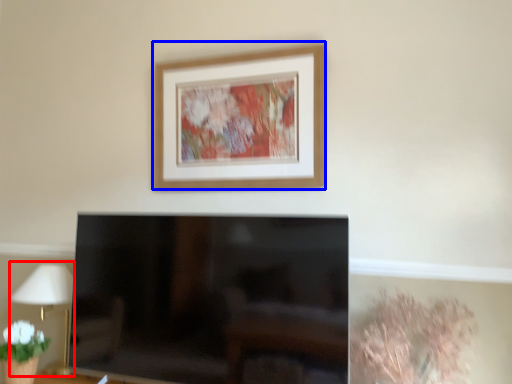
Question: Among these objects, which one is nearest to the camera, table lamp (highlighted by a red box) or picture frame (highlighted by a blue box)?

Choices:
 (A) table lamp
 (B) picture frame

Answer: (B)